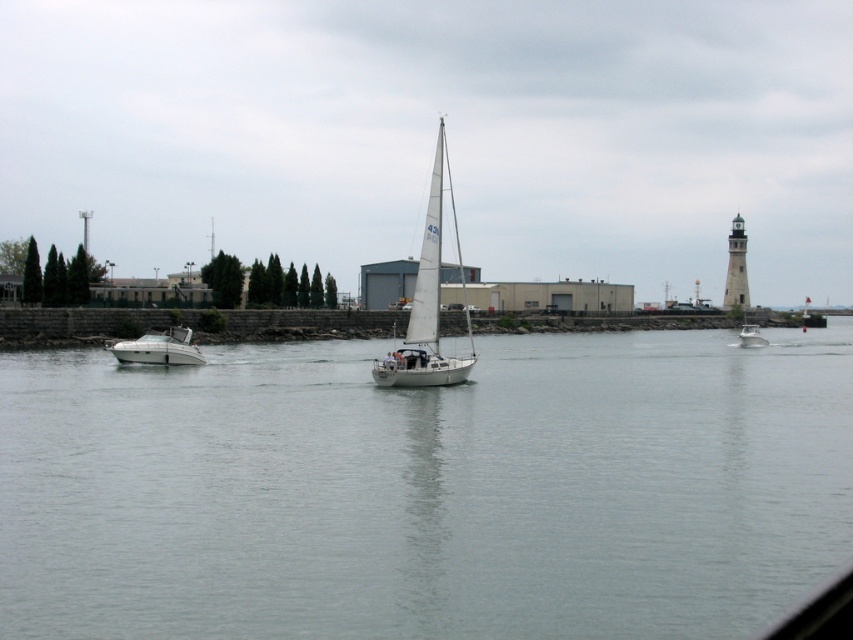
Question: Is white matte sailboat at center closer to camera compared to white glossy motorboat at left?

Choices:
 (A) yes
 (B) no

Answer: (A)

Question: Which of the following is the farthest from the observer?

Choices:
 (A) white glossy boat at right
 (B) clear water at center

Answer: (A)

Question: Estimate the real-world distances between objects in this image. Which object is closer to the white stone lighthouse at right?

Choices:
 (A) white glossy boat at right
 (B) white glossy motorboat at left
 (C) clear water at center

Answer: (A)

Question: Can you confirm if clear water at center is smaller than white stone lighthouse at right?

Choices:
 (A) no
 (B) yes

Answer: (A)

Question: Is white glossy motorboat at left above white glossy boat at right?

Choices:
 (A) no
 (B) yes

Answer: (B)

Question: Which object is farther from the camera taking this photo?

Choices:
 (A) clear water at center
 (B) white matte sailboat at center

Answer: (B)